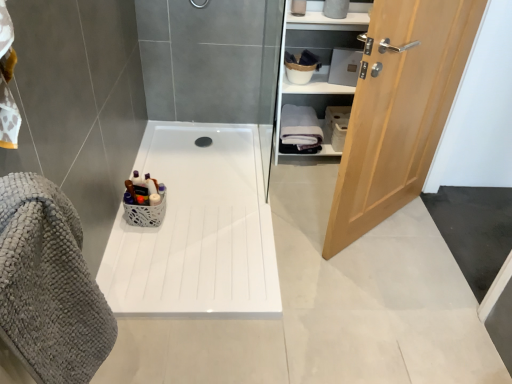
Question: From the image's perspective, is light wood door at right beneath black rubber drain at center?

Choices:
 (A) yes
 (B) no

Answer: (A)

Question: Does light wood door at right have a larger size compared to black rubber drain at center?

Choices:
 (A) no
 (B) yes

Answer: (B)

Question: Is light wood door at right surrounding black rubber drain at center?

Choices:
 (A) no
 (B) yes

Answer: (A)

Question: Is light wood door at right directly adjacent to black rubber drain at center?

Choices:
 (A) yes
 (B) no

Answer: (B)

Question: Is light wood door at right facing towards black rubber drain at center?

Choices:
 (A) yes
 (B) no

Answer: (B)

Question: Is light wood door at right to the right of black rubber drain at center from the viewer's perspective?

Choices:
 (A) yes
 (B) no

Answer: (A)

Question: Is black rubber drain at center shorter than gray textured bath towel at left, the 1th bath towel when ordered from bottom to top?

Choices:
 (A) yes
 (B) no

Answer: (A)

Question: Could you tell me if black rubber drain at center is turned towards gray textured bath towel at left, the 1th bath towel positioned from the front?

Choices:
 (A) no
 (B) yes

Answer: (A)

Question: Does black rubber drain at center come in front of gray textured bath towel at left, the 1th bath towel when ordered from bottom to top?

Choices:
 (A) yes
 (B) no

Answer: (B)

Question: Is gray textured bath towel at left, which appears as the second bath towel when viewed from the back, completely or partially inside black rubber drain at center?

Choices:
 (A) yes
 (B) no

Answer: (B)

Question: Does black rubber drain at center have a smaller size compared to gray textured bath towel at left, which appears as the second bath towel when viewed from the back?

Choices:
 (A) no
 (B) yes

Answer: (B)

Question: Is black rubber drain at center outside gray textured bath towel at left, the 2th bath towel positioned from the right?

Choices:
 (A) yes
 (B) no

Answer: (A)

Question: Could white glossy cabinet at upper right be considered to be inside black rubber drain at center?

Choices:
 (A) yes
 (B) no

Answer: (B)